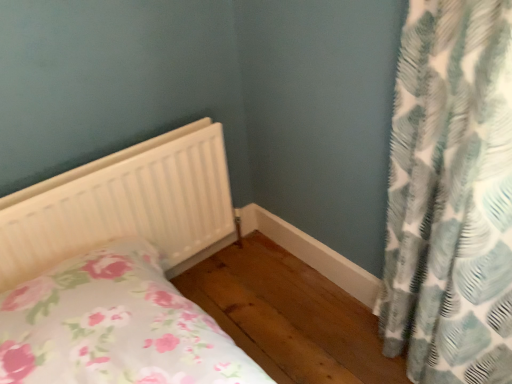
Locate an element on the screen. The width and height of the screenshot is (512, 384). blank space situated above white matte radiator at lower left (from a real-world perspective) is located at coordinates (109, 158).